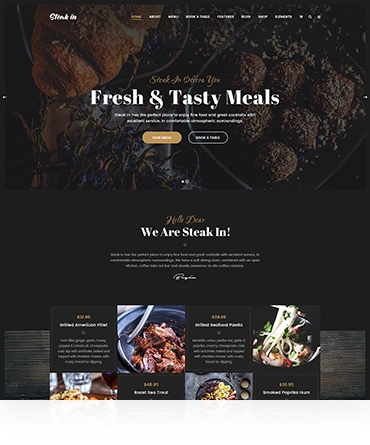
Identify the location of glass of water. (81, 382).